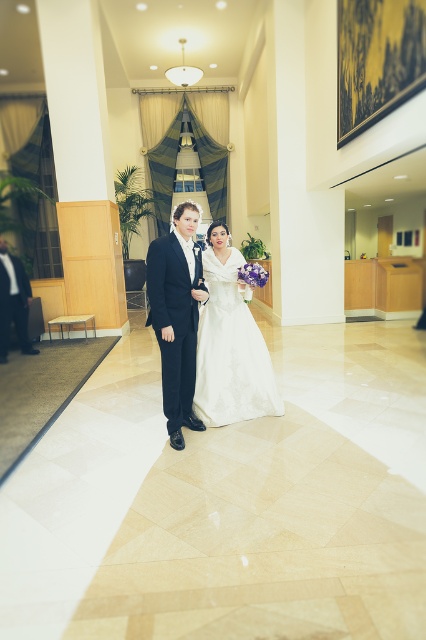
Question: Which point is closer to the camera?

Choices:
 (A) (8, 330)
 (B) (241, 371)

Answer: (B)

Question: Is white satin dress at center closer to the viewer compared to matte black suit at left?

Choices:
 (A) yes
 (B) no

Answer: (A)

Question: Can you confirm if white satin dress at center is positioned below dark blue suit at center?

Choices:
 (A) no
 (B) yes

Answer: (A)

Question: Which point is farther from the camera taking this photo?

Choices:
 (A) coord(2,339)
 (B) coord(216,243)
 (C) coord(187,269)

Answer: (A)

Question: Observing the image, what is the correct spatial positioning of dark blue suit at center in reference to matte black suit at left?

Choices:
 (A) below
 (B) above

Answer: (A)

Question: Estimate the real-world distances between objects in this image. Which object is closer to the matte black suit at left?

Choices:
 (A) white satin dress at center
 (B) dark blue suit at center

Answer: (A)